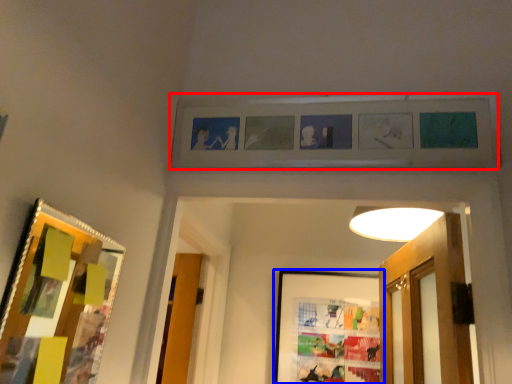
Question: Which of the following is the farthest to the observer, picture frame (highlighted by a red box) or picture frame (highlighted by a blue box)?

Choices:
 (A) picture frame
 (B) picture frame

Answer: (B)